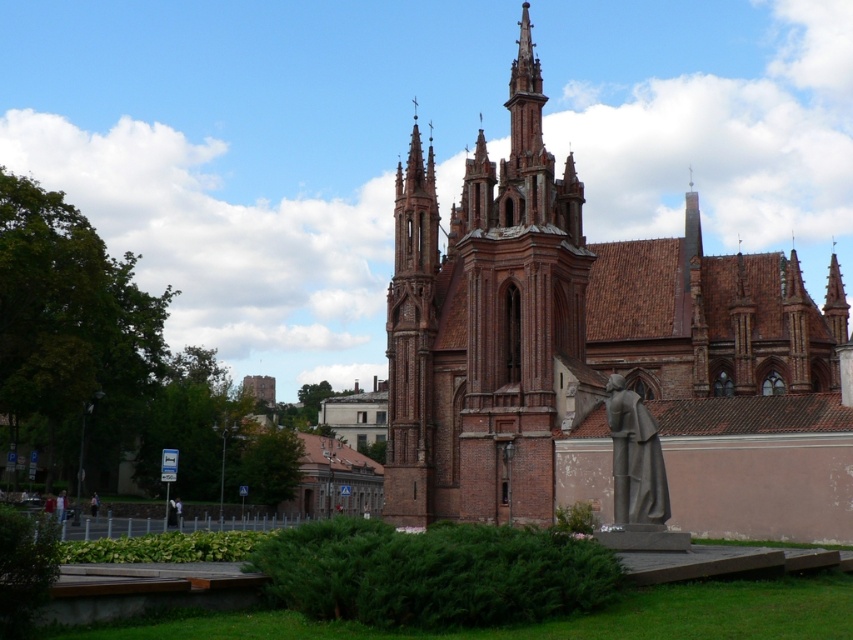
Does red brick church at center have a lesser width compared to light brown fabric jacket at lower left?

In fact, red brick church at center might be wider than light brown fabric jacket at lower left.

In the scene shown: Which is below, red brick church at center or light brown fabric jacket at lower left?

light brown fabric jacket at lower left is below.

Image resolution: width=853 pixels, height=640 pixels. Describe the element at coordinates (601, 355) in the screenshot. I see `red brick church at center` at that location.

Identify the location of red brick church at center. (601, 355).

Who is shorter, red brick church at center or bronze statue at lower right?

bronze statue at lower right

Is red brick church at center taller than bronze statue at lower right?

Indeed, red brick church at center has a greater height compared to bronze statue at lower right.

Who is more distant from viewer, (704, 340) or (624, 460)?

The point (704, 340) is more distant.

Where is `red brick church at center`? red brick church at center is located at coordinates (601, 355).

Can you confirm if bronze statue at lower right is positioned to the left of light brown fabric jacket at lower left?

Incorrect, bronze statue at lower right is not on the left side of light brown fabric jacket at lower left.

In the scene shown: Which is below, bronze statue at lower right or light brown fabric jacket at lower left?

light brown fabric jacket at lower left is lower down.

What do you see at coordinates (635, 460) in the screenshot? I see `bronze statue at lower right` at bounding box center [635, 460].

Find the location of a particular element. The image size is (853, 640). bronze statue at lower right is located at coordinates (635, 460).